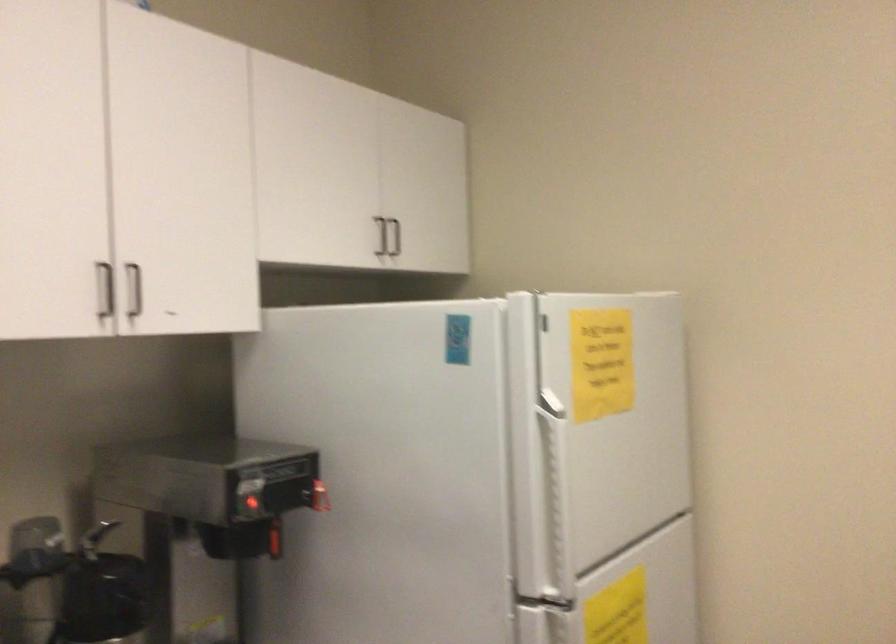
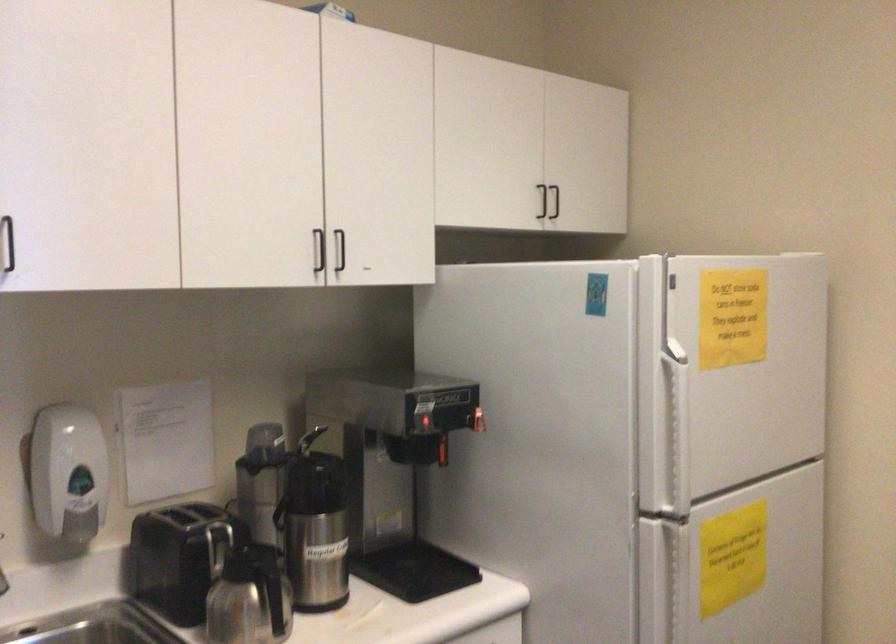
In the second image, find the point that corresponds to (x=556, y=495) in the first image.

(675, 431)